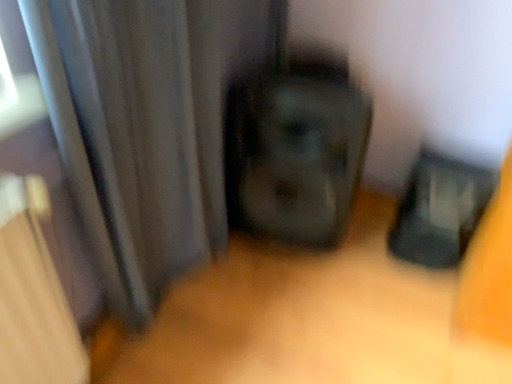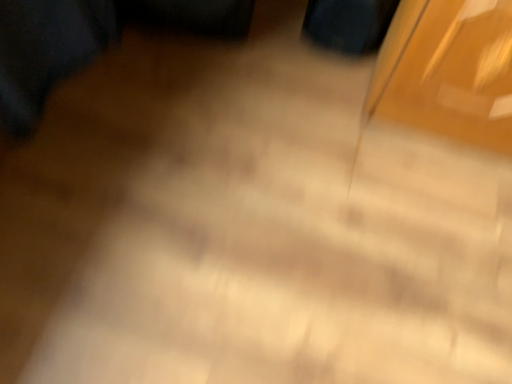
Question: Which way did the camera rotate in the video?

Choices:
 (A) rotated upward
 (B) rotated downward

Answer: (B)